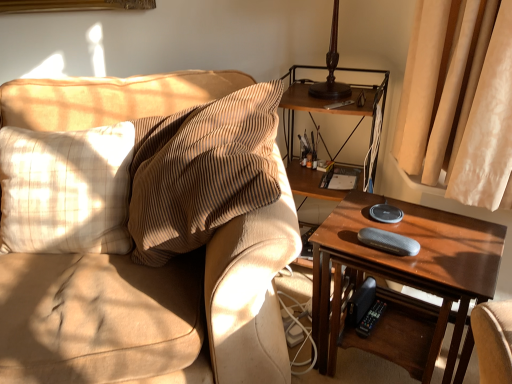
Question: Should I look upward or downward to see wooden shelf at right?

Choices:
 (A) up
 (B) down

Answer: (A)

Question: Is wooden table at right completely or partially inside textured beige couch at left?

Choices:
 (A) no
 (B) yes

Answer: (A)

Question: Is textured beige couch at left outside of wooden table at right?

Choices:
 (A) yes
 (B) no

Answer: (A)

Question: Is textured beige couch at left looking in the opposite direction of wooden table at right?

Choices:
 (A) yes
 (B) no

Answer: (B)

Question: Does textured beige couch at left have a smaller size compared to wooden table at right?

Choices:
 (A) no
 (B) yes

Answer: (A)

Question: From a real-world perspective, is textured beige couch at left on wooden table at right?

Choices:
 (A) no
 (B) yes

Answer: (B)

Question: From a real-world perspective, is textured beige couch at left located beneath wooden table at right?

Choices:
 (A) no
 (B) yes

Answer: (A)

Question: Is wooden table at right at the right side of textured beige couch at left?

Choices:
 (A) no
 (B) yes

Answer: (B)

Question: Would you say wooden table at right is outside textured beige couch at left?

Choices:
 (A) yes
 (B) no

Answer: (A)

Question: Is wooden table at right in contact with textured beige couch at left?

Choices:
 (A) yes
 (B) no

Answer: (B)

Question: Is wooden table at right closer to the viewer compared to textured beige couch at left?

Choices:
 (A) no
 (B) yes

Answer: (A)

Question: Can you confirm if wooden table at right is bigger than textured beige couch at left?

Choices:
 (A) no
 (B) yes

Answer: (A)

Question: Considering the relative sizes of wooden table at right and textured beige couch at left in the image provided, is wooden table at right thinner than textured beige couch at left?

Choices:
 (A) no
 (B) yes

Answer: (B)

Question: Can you confirm if wooden shelf at right is wider than wooden table at right?

Choices:
 (A) no
 (B) yes

Answer: (A)